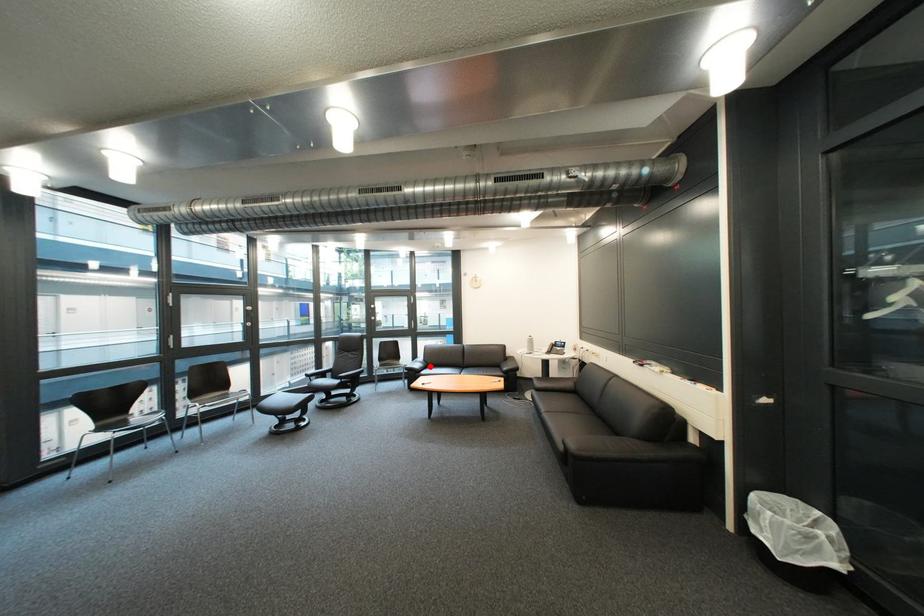
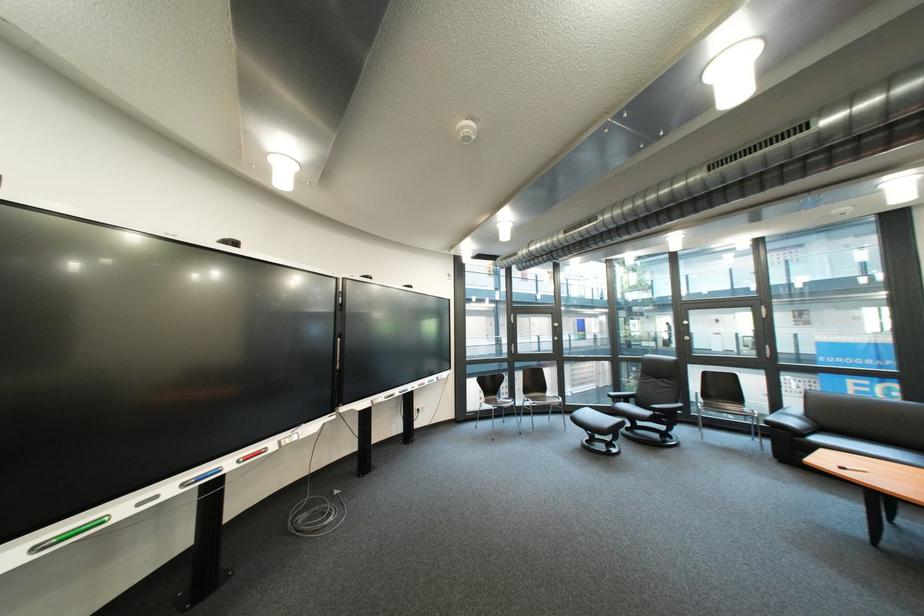
The point at the highlighted location is marked in the first image. Where is the corresponding point in the second image?

(806, 423)